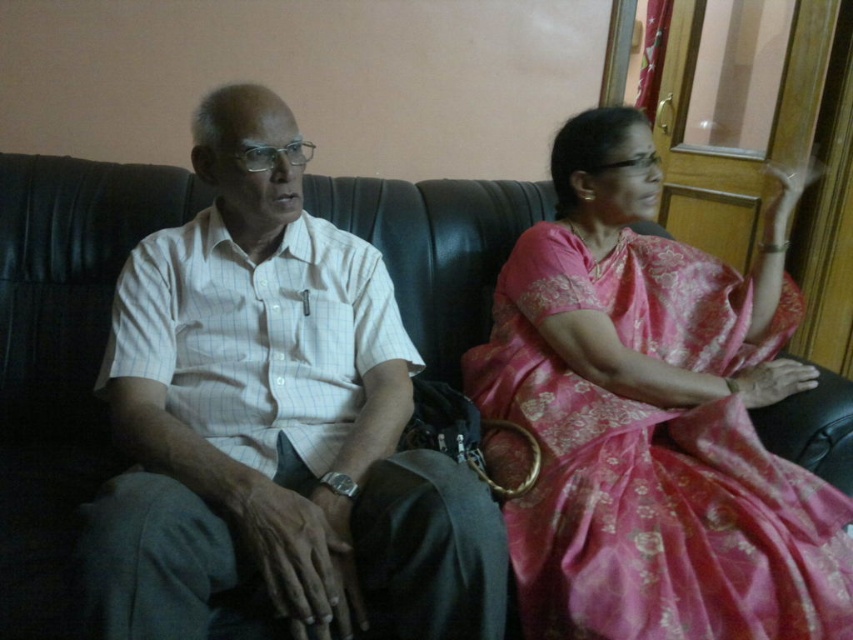
You are designing a layout for a photo album page that must include both the white striped shirt at center and the pink silk saree at right. The page has a vertical orientation. Which object should be placed higher on the page to maintain their relative heights as shown in the image?

The pink silk saree at right should be placed higher on the page because it is taller than the white striped shirt at center, so positioning it higher would preserve their height relationship.

You are a photographer standing 3 feet away from the white striped shirt at center. Can you capture a clear closeup shot of the shirt without moving closer?

The distance of white striped shirt at center from camera is 33.66 inches, which is approximately 2.8 feet. Since you are standing 3 feet away, you can capture a clear closeup shot without moving closer.

You are standing in the living room and want to place a small potted plant between the two points, point (262,209) and point (631,122). Which point should the plant be closer to so it is in front of both points?

The plant should be closer to point (262,209) because it is in front of point (631,122).